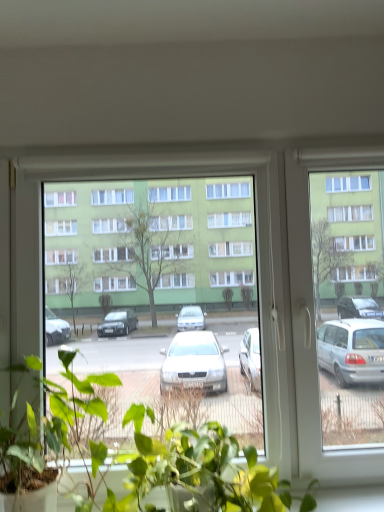
Question: Is point (13, 368) closer or farther from the camera than point (288, 482)?

Choices:
 (A) farther
 (B) closer

Answer: (A)

Question: Is green matte plant at center, acting as the second houseplant starting from the right, bigger or smaller than green leafy plant at lower center, which is the first houseplant in right-to-left order?

Choices:
 (A) small
 (B) big

Answer: (B)

Question: Which of these objects is positioned farthest from the transparent glass window at center?

Choices:
 (A) green leafy plant at lower center, the second houseplant viewed from the left
 (B) green matte plant at center, acting as the second houseplant starting from the right

Answer: (B)

Question: Considering the real-world distances, which object is closest to the transparent glass window at center?

Choices:
 (A) green matte plant at center, acting as the second houseplant starting from the right
 (B) green leafy plant at lower center, which is the first houseplant in right-to-left order

Answer: (B)